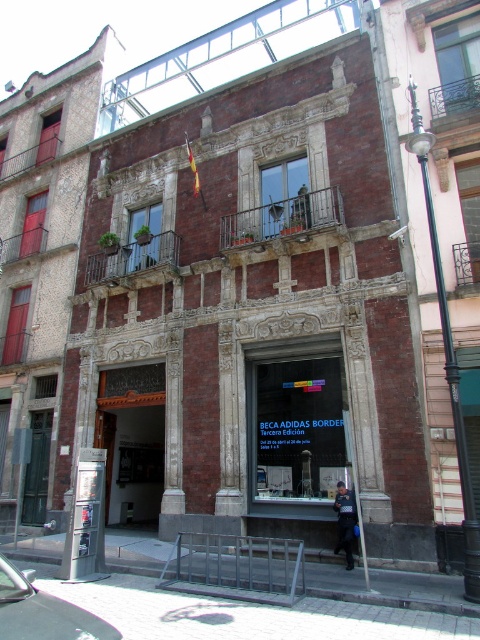
Question: Which point is farther to the camera?

Choices:
 (A) (348, 492)
 (B) (303, 140)

Answer: (B)

Question: Is brick facade storefront at center smaller than dark blue uniform at center?

Choices:
 (A) yes
 (B) no

Answer: (B)

Question: Is the position of brick facade storefront at center less distant than that of dark blue uniform at center?

Choices:
 (A) no
 (B) yes

Answer: (B)

Question: Does brick facade storefront at center have a smaller size compared to dark blue uniform at center?

Choices:
 (A) no
 (B) yes

Answer: (A)

Question: Which of the following is the farthest from the observer?

Choices:
 (A) [x=345, y=513]
 (B) [x=112, y=168]

Answer: (B)

Question: Which point is closer to the camera taking this photo?

Choices:
 (A) (342, 512)
 (B) (108, 417)

Answer: (A)